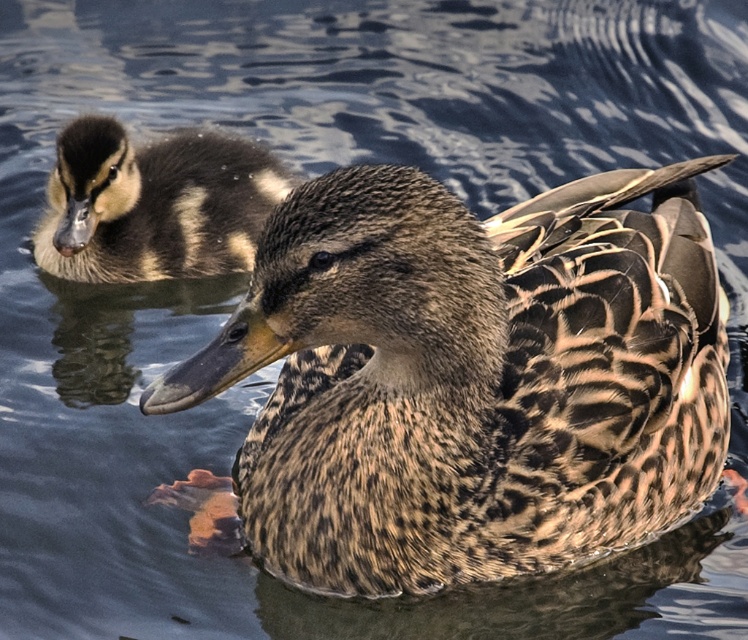
You are a photographer aiming to capture a clear photo of both the brown speckled duck at center and the brown speckled duckling at upper left. However, the foreground duck is blocking the view of the duckling. Can you adjust your position to see the duckling behind the duck at center?

The brown speckled duck at center is in front of the brown speckled duckling at upper left, so moving your position slightly to the side might allow you to see the duckling behind the duck.

You are a birdwatcher trying to locate the brown speckled duck at center in the image. Can you tell me its exact coordinates?

The brown speckled duck at center is located at coordinates point (468, 378).